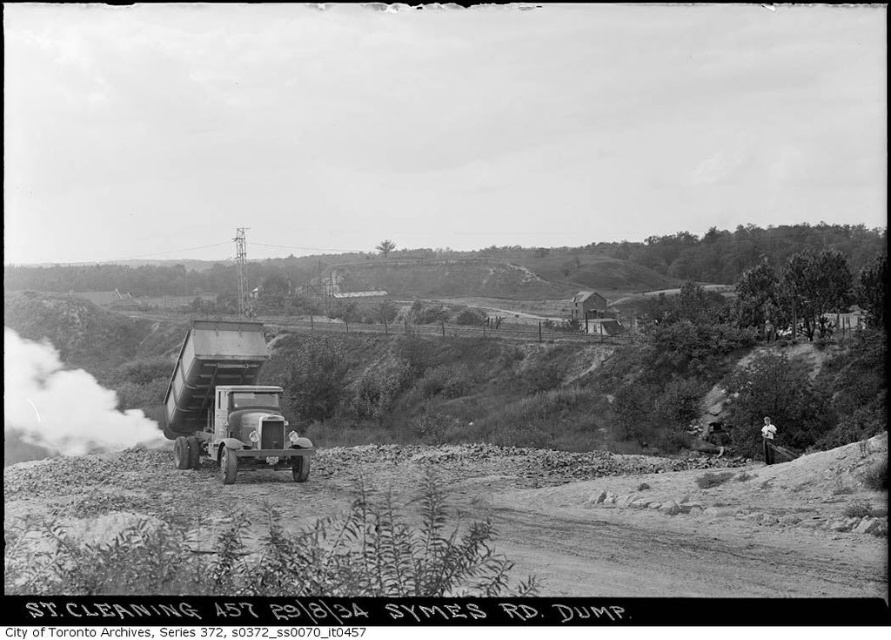
You are a GUI agent. You are given a task and a screenshot of the screen. Output one action in this format:
    pyautogui.click(x=<x>, y=<y>)
    Task: Click on the dirt track at lower center
    
    Given the screenshot: What is the action you would take?
    pyautogui.click(x=448, y=524)

Is dirt track at lower center taller than metallic silver trailer truck at center?

Indeed, dirt track at lower center has a greater height compared to metallic silver trailer truck at center.

Is point (675, 540) farther from camera compared to point (215, 326)?

No, (675, 540) is in front of (215, 326).

This screenshot has height=640, width=891. Identify the location of dirt track at lower center. (448, 524).

Is metallic silver trailer truck at center shorter than white smoke at center?

Indeed, metallic silver trailer truck at center has a lesser height compared to white smoke at center.

Who is more distant from viewer, (283, 420) or (86, 451)?

The point (86, 451) is more distant.

Where is `metallic silver trailer truck at center`? The height and width of the screenshot is (640, 891). metallic silver trailer truck at center is located at coordinates (227, 404).

Consider the image. Does dirt track at lower center come behind white smoke at center?

No, dirt track at lower center is in front of white smoke at center.

Which of these two, dirt track at lower center or white smoke at center, stands taller?

Standing taller between the two is white smoke at center.

Between point (339, 497) and point (86, 380), which one is positioned in front?

Point (339, 497) is more forward.

Where is `dirt track at lower center`? This screenshot has width=891, height=640. dirt track at lower center is located at coordinates (448, 524).